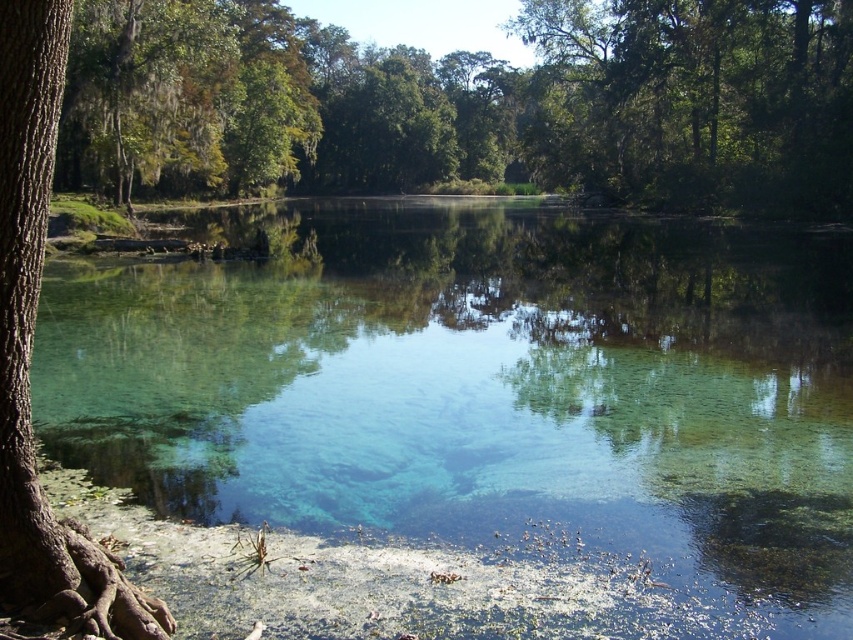
Question: Does green leafy tree at upper center lie behind green leafy tree at upper right?

Choices:
 (A) yes
 (B) no

Answer: (B)

Question: Is clear water at center to the right of green leafy tree at upper right from the viewer's perspective?

Choices:
 (A) yes
 (B) no

Answer: (B)

Question: Which object is the farthest from the green leafy tree at upper center?

Choices:
 (A) green leafy tree at upper right
 (B) clear water at center
 (C) brown rough bark tree at left

Answer: (C)

Question: Which object appears closest to the camera in this image?

Choices:
 (A) green leafy tree at upper center
 (B) green leafy tree at upper right

Answer: (A)

Question: Is green leafy tree at upper center thinner than brown rough bark tree at left?

Choices:
 (A) no
 (B) yes

Answer: (A)

Question: Which object appears closest to the camera in this image?

Choices:
 (A) brown rough bark tree at left
 (B) green leafy tree at upper right
 (C) clear water at center
 (D) green leafy tree at upper center

Answer: (A)